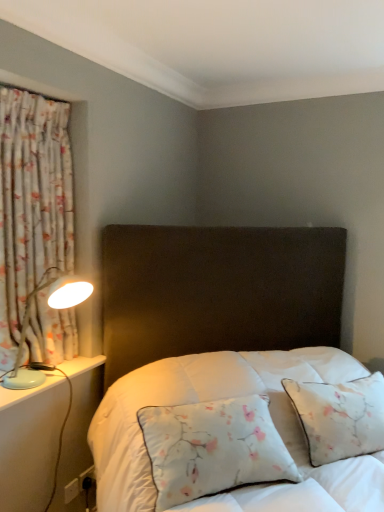
What are the coordinates of `vacant area on top of floral fabric curtain at left (from a real-world perspective)` in the screenshot? It's located at (36, 92).